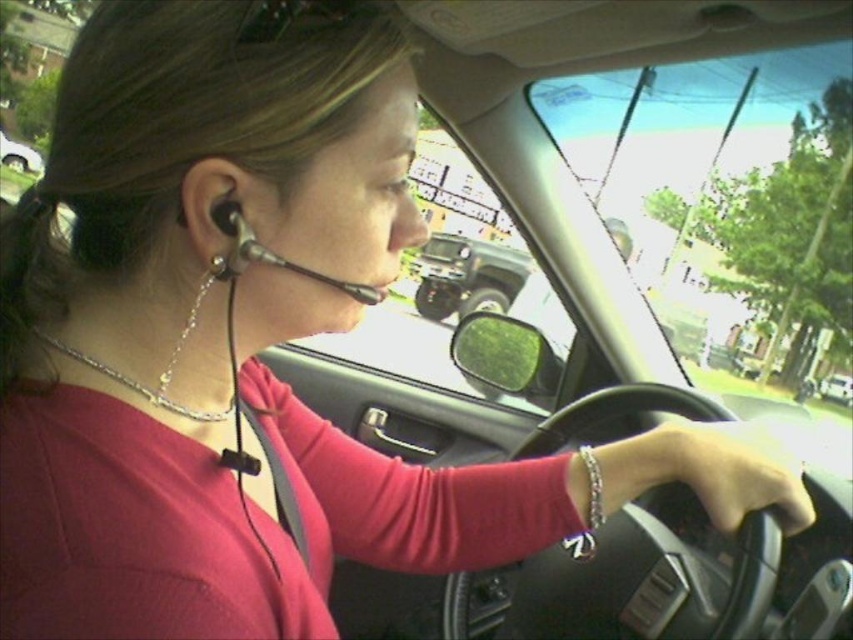
Question: Which object is the closest to the black rubber steering wheel at center?

Choices:
 (A) matte black headset at upper left
 (B) metallic silver car at center
 (C) black matte earphone at left
 (D) green matte truck at center

Answer: (C)

Question: Does black rubber steering wheel at center appear on the left side of black matte earphone at left?

Choices:
 (A) no
 (B) yes

Answer: (A)

Question: Which object is closer to the camera taking this photo?

Choices:
 (A) green matte truck at center
 (B) black rubber steering wheel at center

Answer: (B)

Question: Which object is farther from the camera taking this photo?

Choices:
 (A) matte black headset at upper left
 (B) green matte truck at center
 (C) black matte earphone at left
 (D) metallic silver car at center

Answer: (D)

Question: Is green matte truck at center to the left of matte black headset at upper left from the viewer's perspective?

Choices:
 (A) yes
 (B) no

Answer: (B)

Question: Is black rubber steering wheel at center thinner than matte black headset at upper left?

Choices:
 (A) no
 (B) yes

Answer: (B)